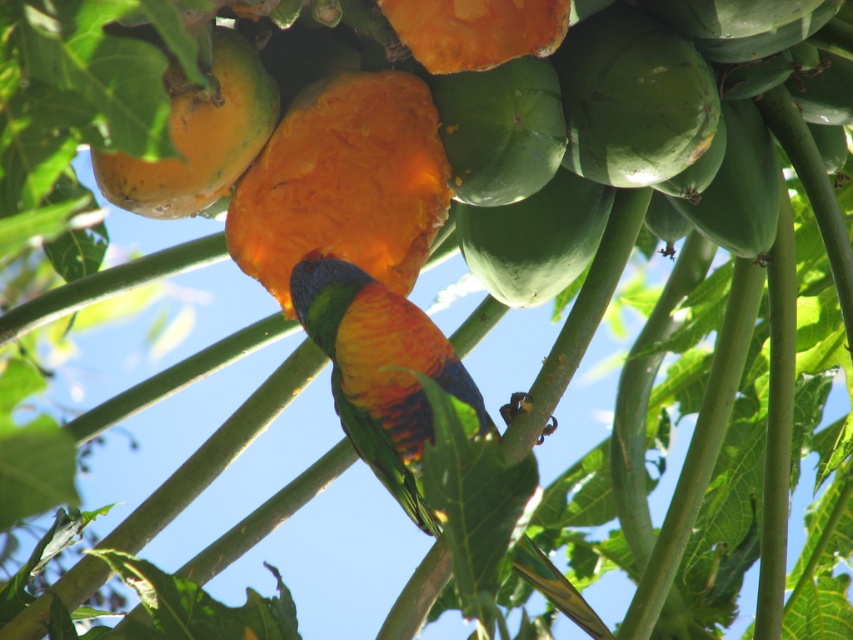
Between point (239, 92) and point (410, 368), which one is positioned behind?

The point (410, 368) is behind.

Is orange papaya at center smaller than rainbow feathered parrot at center?

No, orange papaya at center is not smaller than rainbow feathered parrot at center.

Is point (601, 17) closer to viewer compared to point (421, 387)?

No, (601, 17) is further to viewer.

Find the location of `orange papaya at center`. orange papaya at center is located at coordinates (524, 141).

Is point (387, 216) closer to viewer compared to point (184, 150)?

No, it is behind (184, 150).

This screenshot has height=640, width=853. I want to click on orange matte papaya at center, so click(344, 182).

Is orange papaya at center positioned at the back of orange matte papaya at center?

No.

Between point (805, 102) and point (271, 236), which one is positioned in front?

Positioned in front is point (271, 236).

Image resolution: width=853 pixels, height=640 pixels. I want to click on orange papaya at center, so click(x=524, y=141).